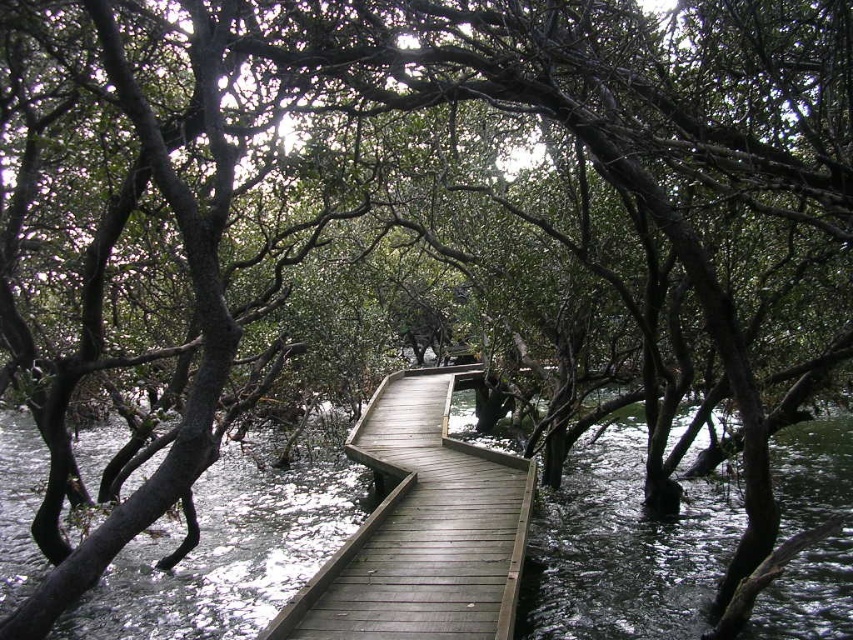
Who is more forward, (250, 593) or (448, 385)?

Point (250, 593)

Can you confirm if greenish-brown wood at center is shorter than wooden walkway at center?

No, greenish-brown wood at center is not shorter than wooden walkway at center.

Is point (38, 577) positioned after point (329, 566)?

Yes.

This screenshot has height=640, width=853. What are the coordinates of `greenish-brown wood at center` in the screenshot? It's located at (425, 532).